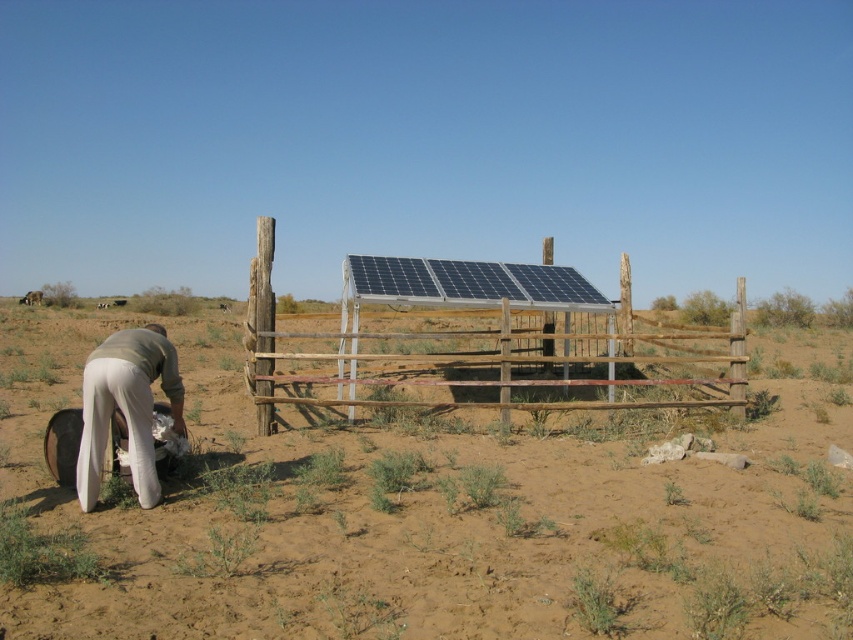
Who is positioned more to the right, brown sandy dirt field at center or wooden fence at center?

wooden fence at center is more to the right.

I want to click on brown sandy dirt field at center, so click(x=436, y=516).

The width and height of the screenshot is (853, 640). What are the coordinates of `brown sandy dirt field at center` in the screenshot? It's located at (436, 516).

Can you confirm if brown sandy dirt field at center is positioned above light beige fabric at lower left?

No, brown sandy dirt field at center is not above light beige fabric at lower left.

Is brown sandy dirt field at center to the right of light beige fabric at lower left from the viewer's perspective?

Yes, brown sandy dirt field at center is to the right of light beige fabric at lower left.

Is point (643, 444) less distant than point (102, 449)?

No, it is behind (102, 449).

Where is `brown sandy dirt field at center`? The image size is (853, 640). brown sandy dirt field at center is located at coordinates (436, 516).

Is wooden fence at center taller than light beige fabric at lower left?

Indeed, wooden fence at center has a greater height compared to light beige fabric at lower left.

Is point (491, 340) closer to viewer compared to point (88, 404)?

No, it is behind (88, 404).

Locate an element on the screen. wooden fence at center is located at coordinates (474, 337).

This screenshot has height=640, width=853. What are the coordinates of `wooden fence at center` in the screenshot? It's located at coord(474,337).